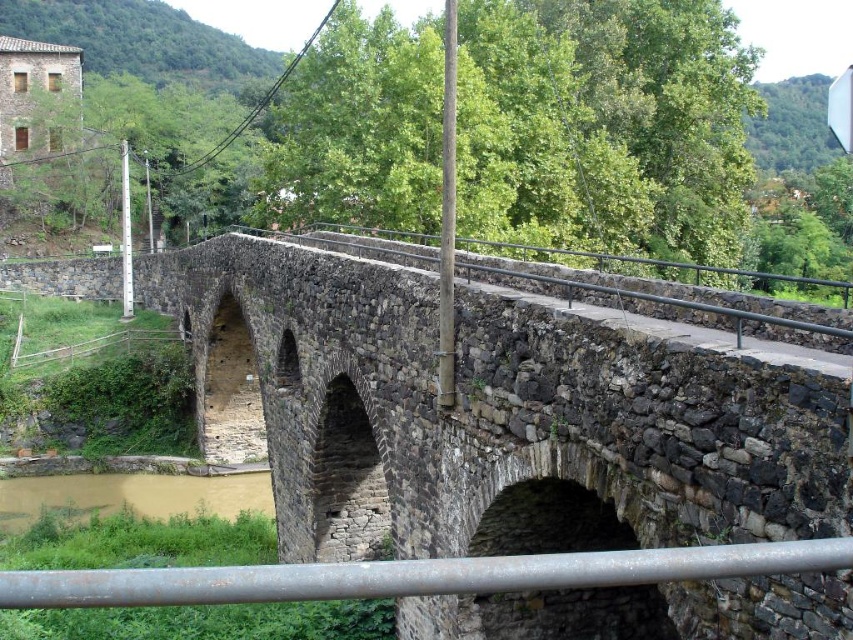
Question: Estimate the real-world distances between objects in this image. Which object is farther from the brown muddy water at lower left?

Choices:
 (A) rustic stone bridge at center
 (B) rusty metal rail at lower center

Answer: (B)

Question: Does rusty metal rail at lower center appear over brown muddy water at lower left?

Choices:
 (A) no
 (B) yes

Answer: (B)

Question: Which point is closer to the camera taking this photo?

Choices:
 (A) (224, 492)
 (B) (668, 550)
 (C) (387, 321)

Answer: (B)

Question: Can you confirm if rustic stone bridge at center is positioned below brown muddy water at lower left?

Choices:
 (A) yes
 (B) no

Answer: (B)

Question: Among these objects, which one is nearest to the camera?

Choices:
 (A) brown muddy water at lower left
 (B) rustic stone bridge at center

Answer: (B)

Question: Is rustic stone bridge at center closer to camera compared to rusty metal rail at lower center?

Choices:
 (A) yes
 (B) no

Answer: (B)